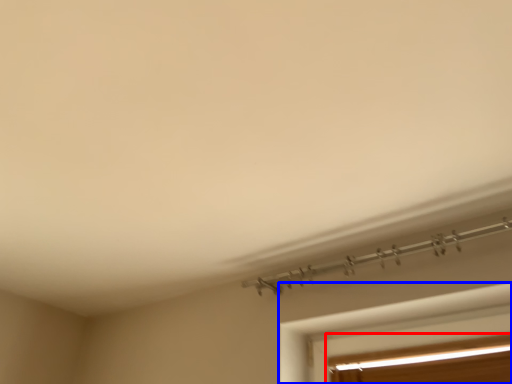
Question: Which of the following is the farthest to the observer, window (highlighted by a red box) or window (highlighted by a blue box)?

Choices:
 (A) window
 (B) window

Answer: (A)